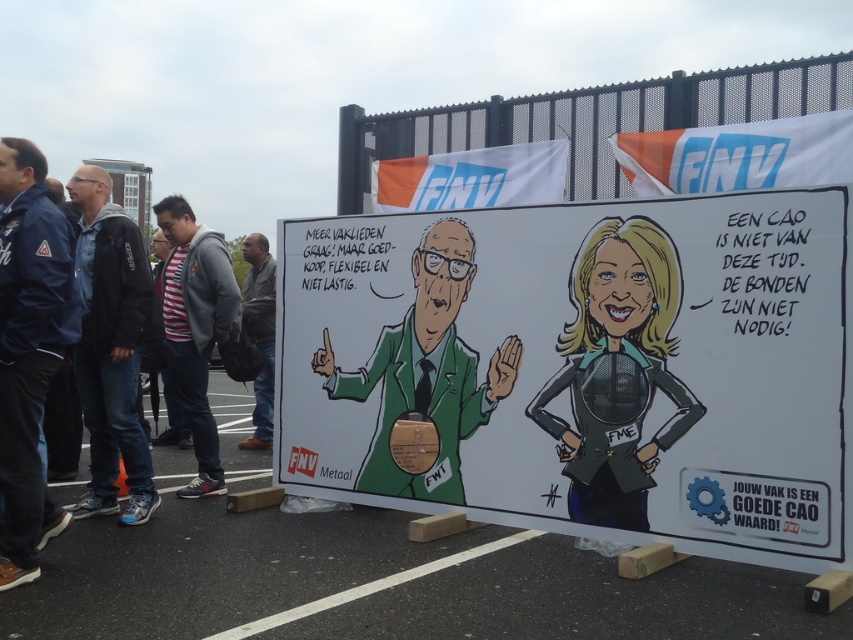
You are a photographer trying to capture a clear shot of both the green matte suit at center and the black jacket at left in the same frame. Based on their positions, which one should you focus on first to ensure both are in focus?

The green matte suit at center is positioned under the black jacket at left, so you should focus on the black jacket at left first to ensure both are in focus.